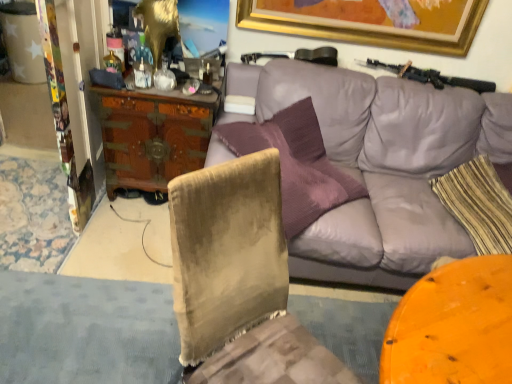
Question: Considering the positions of point (86, 322) and point (474, 248), is point (86, 322) closer or farther from the camera than point (474, 248)?

Choices:
 (A) farther
 (B) closer

Answer: (B)

Question: From a real-world perspective, is velvet chair at lower left above or below purple leather couch at upper center?

Choices:
 (A) above
 (B) below

Answer: (B)

Question: Which is farther from the velvet chair at lower left?

Choices:
 (A) purple leather couch at upper center
 (B) wooden carved desk at center left
 (C) striped fabric pillow at right
 (D) black matte shotgun at upper right

Answer: (D)

Question: Which object is positioned farthest from the black matte shotgun at upper right?

Choices:
 (A) purple leather couch at upper center
 (B) velvet chair at lower left
 (C) striped fabric pillow at right
 (D) wooden carved desk at center left

Answer: (B)